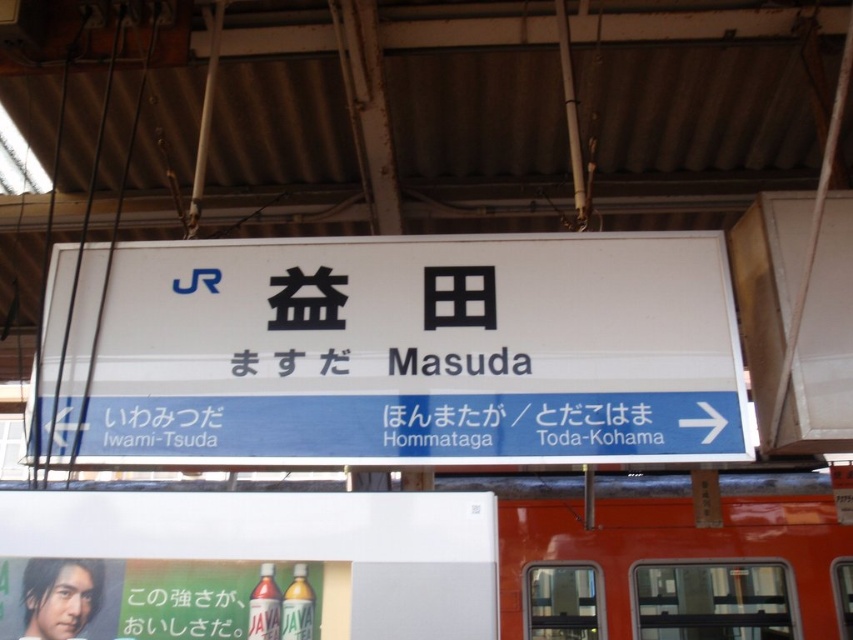
You are standing at the train station platform and see the white matte signboard at center and the matte plastic bottle at lower center. Which object is closer to your right side?

The white matte signboard at center is positioned on the right side of the matte plastic bottle at lower center, so it is closer to your right side.

Where is the white matte signboard at center located on the image?

The white matte signboard at center is located at point (396, 352) on the image.